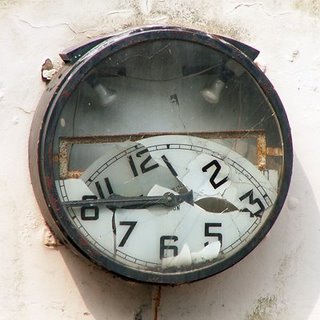
The image size is (320, 320). Identify the location of wall. (292, 247), (13, 279), (29, 51), (299, 64).